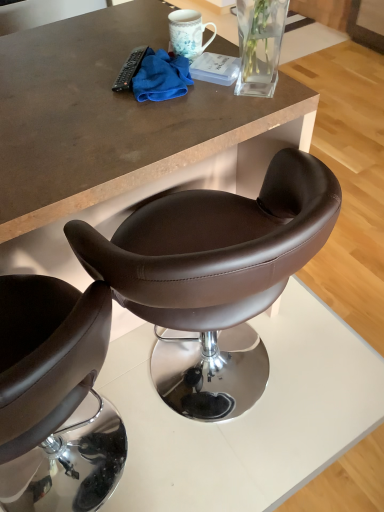
At what (x,y) coordinates should I click in order to perform the action: click on vacant space in front of black plastic remote control at upper center. Please return your answer as a coordinate pair (x, y). This screenshot has height=512, width=384. Looking at the image, I should click on (128, 113).